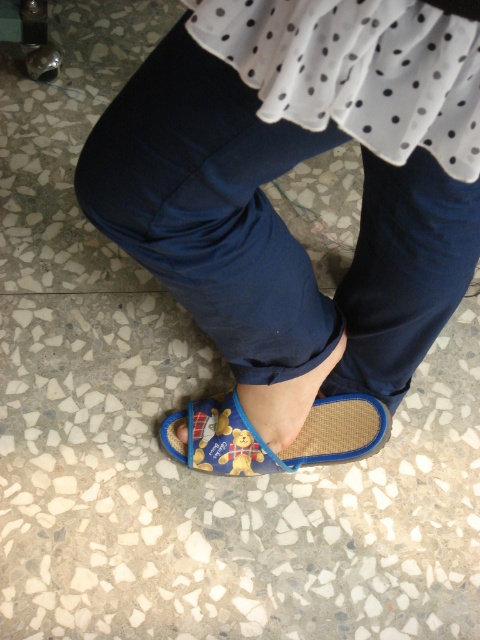
Question: Which is farther from the blue fabric toe at lower center?

Choices:
 (A) blue woven sandal at lower center
 (B) blue fabric pants at lower center
 (C) white dotted fabric at upper center

Answer: (C)

Question: Can you confirm if blue fabric pants at lower center is bigger than blue woven sandal at lower center?

Choices:
 (A) yes
 (B) no

Answer: (A)

Question: Which object is farther from the camera taking this photo?

Choices:
 (A) white dotted fabric at upper center
 (B) blue fabric pants at lower center
 (C) blue fabric toe at lower center
 (D) blue woven sandal at lower center

Answer: (C)

Question: Does blue fabric pants at lower center have a greater width compared to blue woven sandal at lower center?

Choices:
 (A) no
 (B) yes

Answer: (B)

Question: Which point is farther to the camera?

Choices:
 (A) (371, 102)
 (B) (324, 429)

Answer: (B)

Question: Does blue fabric pants at lower center have a greater width compared to white dotted fabric at upper center?

Choices:
 (A) yes
 (B) no

Answer: (A)